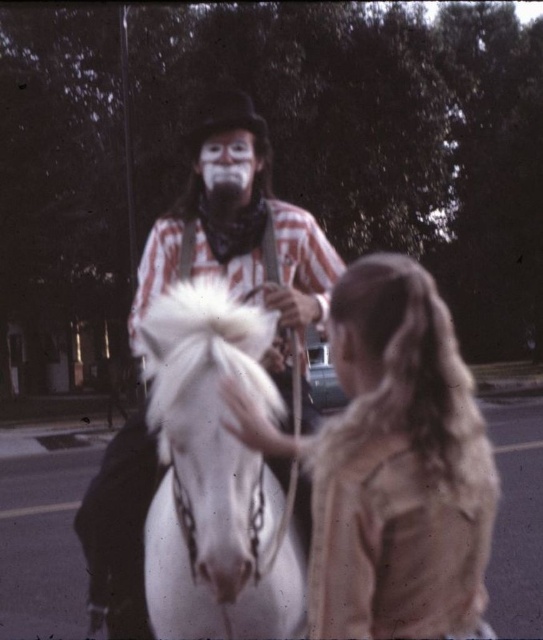
You are standing in front of the scene and want to know which of the two points, point [426,369] or point [301,246], is closer to you. Can you determine this based on the spatial arrangement?

Point [426,369] is closer to the camera than point [301,246], so it is closer to you.